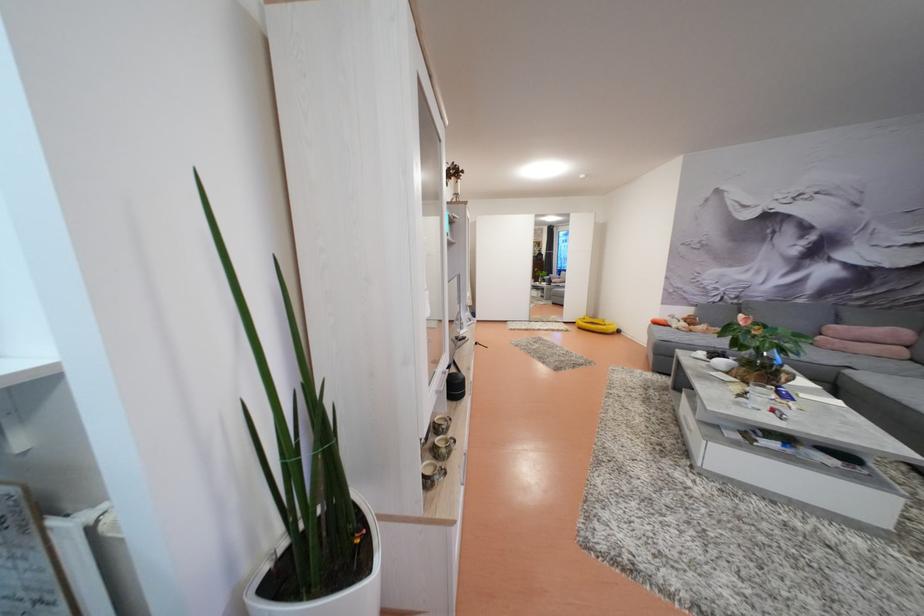
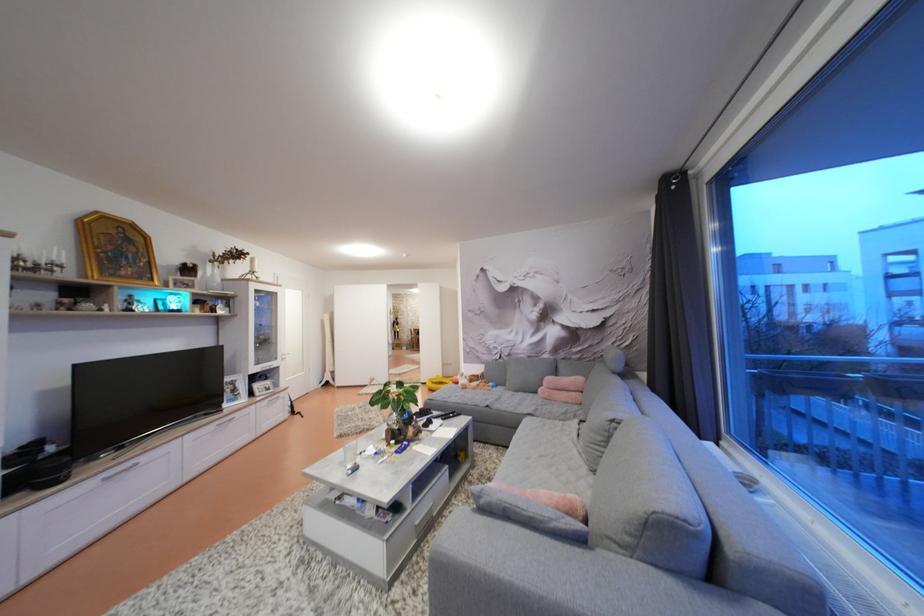
Locate, in the second image, the point that corresponds to point (841, 333) in the first image.

(556, 384)